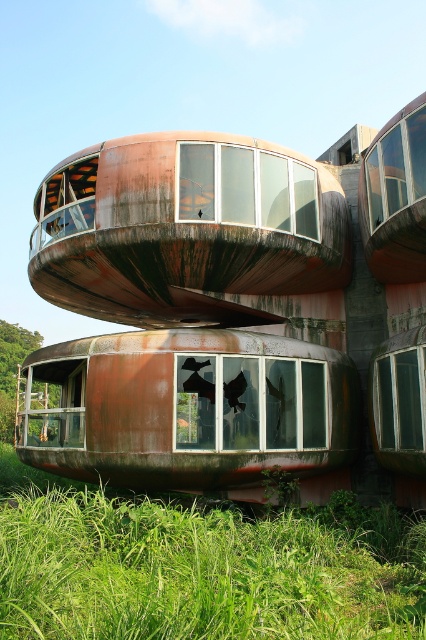
You are standing at the entrance of the abandoned structure and want to walk towards the rusty metal train car at lower center. There is green grassy at lower left nearby. Which direction should you walk to avoid the grassy area and reach the train car?

To avoid the green grassy at lower left and reach the rusty metal train car at lower center, walk towards the train car while staying on the side opposite the grassy area since the grassy area is wider than the train car.

You are standing at the base of the abandoned structure and notice green grassy at lower left and rusty metal train car at lower center. Which object is closer to you?

The green grassy at lower left is closer to you because it is in front of the rusty metal train car at lower center.